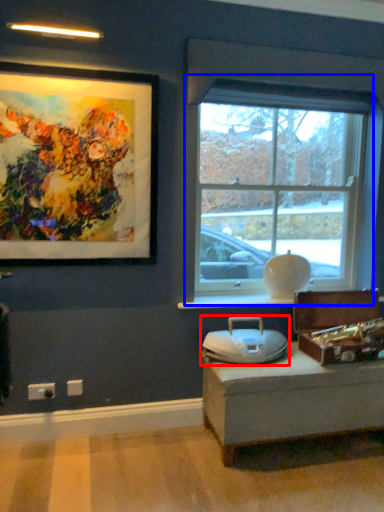
Question: Among these objects, which one is farthest to the camera, swivel chair (highlighted by a red box) or window (highlighted by a blue box)?

Choices:
 (A) swivel chair
 (B) window

Answer: (B)